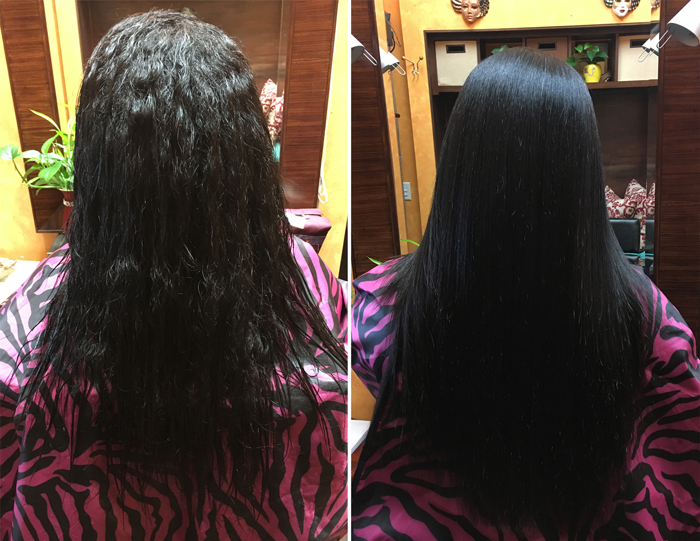
The width and height of the screenshot is (700, 541). Find the location of `lamp`. lamp is located at coordinates (677, 25), (390, 61), (356, 46).